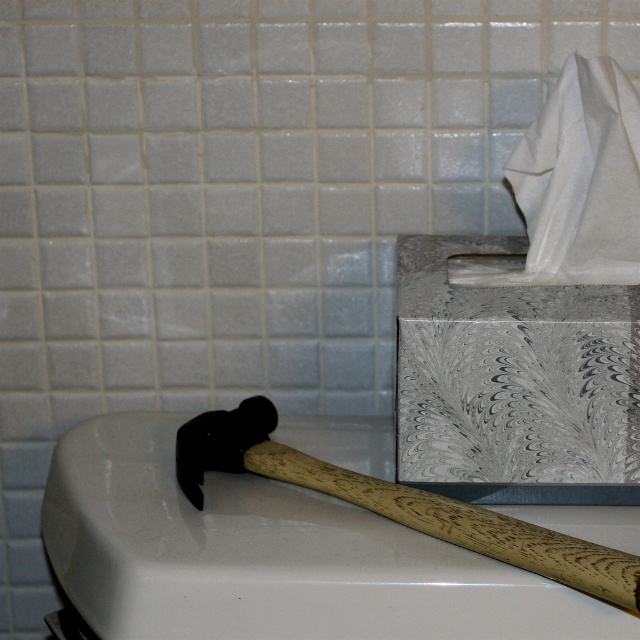
Can you confirm if white marbled tissue at upper right is positioned to the right of wooden textured hammer at lower left?

Yes, white marbled tissue at upper right is to the right of wooden textured hammer at lower left.

Is the position of white marbled tissue at upper right more distant than that of wooden textured hammer at lower left?

Yes.

Does point (627, 148) lie behind point (547, 570)?

Yes, point (627, 148) is farther from viewer.

Locate an element on the screen. white marbled tissue at upper right is located at coordinates (532, 316).